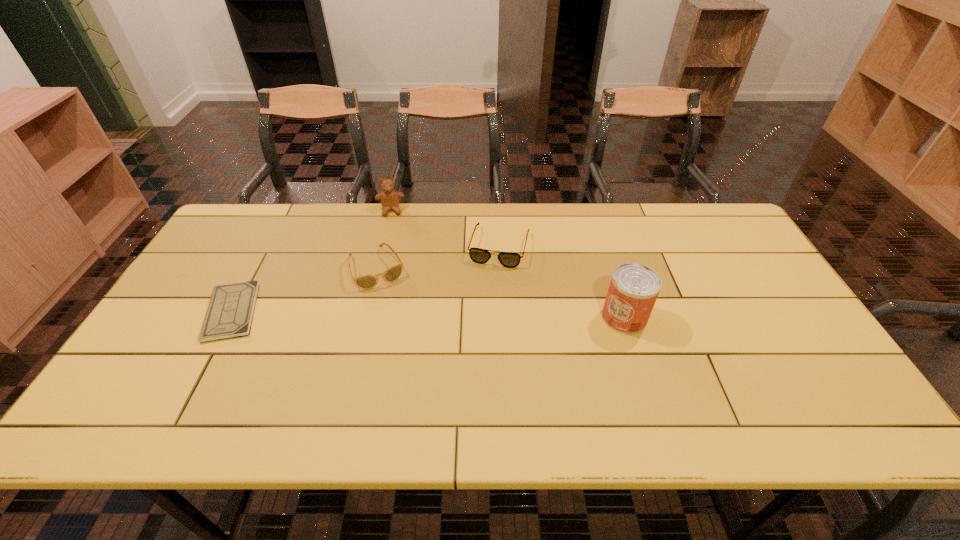
This screenshot has width=960, height=540. I want to click on vacant space on the desktop that is between the checkbook and the can and is positioned on the front-facing side of the sunglasses, so (x=399, y=314).

The height and width of the screenshot is (540, 960). What are the coordinates of `free spot on the desktop that is between the shortest object and the can and is positioned on the front-facing side of the spectacles` in the screenshot? It's located at (481, 315).

The image size is (960, 540). I want to click on free spot on the desktop that is between the checkbook and the tallest object and is positioned on the face of the teddy bear, so 397,314.